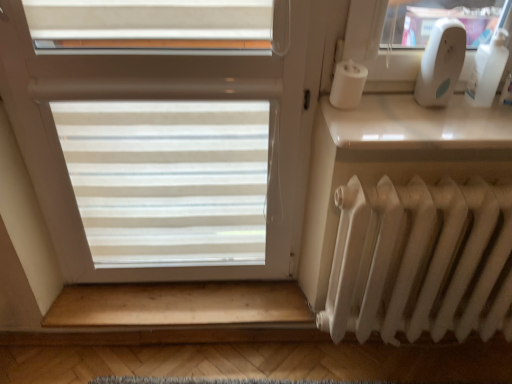
Question: Are white plastic bottle at upper right and white translucent blinds at center making contact?

Choices:
 (A) yes
 (B) no

Answer: (B)

Question: Is white plastic bottle at upper right at the right side of white translucent blinds at center?

Choices:
 (A) no
 (B) yes

Answer: (B)

Question: Is white plastic bottle at upper right not within white translucent blinds at center?

Choices:
 (A) yes
 (B) no

Answer: (A)

Question: From a real-world perspective, is white plastic bottle at upper right physically below white translucent blinds at center?

Choices:
 (A) no
 (B) yes

Answer: (A)

Question: Does white plastic bottle at upper right turn towards white translucent blinds at center?

Choices:
 (A) yes
 (B) no

Answer: (B)

Question: Can you confirm if white plastic bottle at upper right is wider than white translucent blinds at center?

Choices:
 (A) no
 (B) yes

Answer: (A)

Question: From the image's perspective, is white plastic bottle at upper right on white glossy window sill at upper right?

Choices:
 (A) no
 (B) yes

Answer: (B)

Question: Would you say white plastic bottle at upper right is outside white glossy window sill at upper right?

Choices:
 (A) no
 (B) yes

Answer: (B)

Question: Considering the relative positions of white plastic bottle at upper right and white glossy window sill at upper right in the image provided, is white plastic bottle at upper right in front of white glossy window sill at upper right?

Choices:
 (A) no
 (B) yes

Answer: (A)

Question: Considering the relative positions of white plastic bottle at upper right and white glossy window sill at upper right in the image provided, is white plastic bottle at upper right to the right of white glossy window sill at upper right from the viewer's perspective?

Choices:
 (A) no
 (B) yes

Answer: (B)

Question: Would you consider white plastic bottle at upper right to be distant from white glossy window sill at upper right?

Choices:
 (A) no
 (B) yes

Answer: (A)

Question: Can you confirm if white plastic bottle at upper right is smaller than white glossy window sill at upper right?

Choices:
 (A) no
 (B) yes

Answer: (B)

Question: Is white translucent blinds at center oriented towards white glossy window sill at upper right?

Choices:
 (A) no
 (B) yes

Answer: (A)